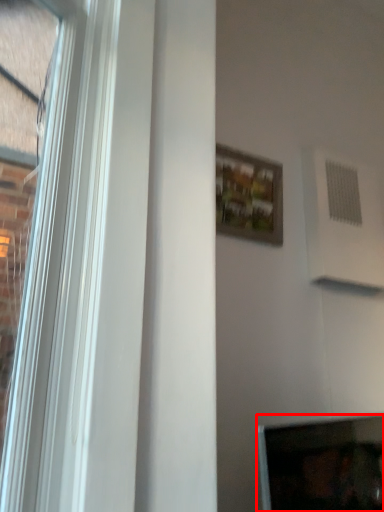
Question: From the image's perspective, where is computer screen (annotated by the red box) located in relation to picture frame in the image?

Choices:
 (A) above
 (B) below

Answer: (B)